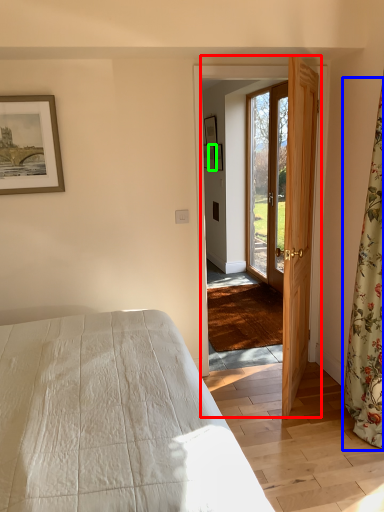
Question: Based on their relative distances, which object is farther from screen door (highlighted by a red box)? Choose from curtain (highlighted by a blue box) and picture frame (highlighted by a green box).

Choices:
 (A) curtain
 (B) picture frame

Answer: (B)